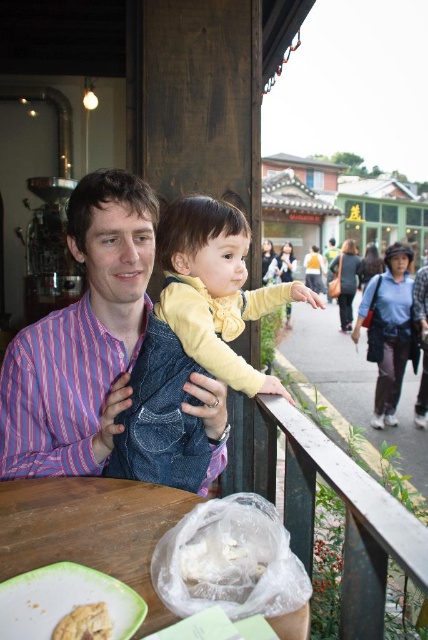
Between point (181, 484) and point (29, 492), which one is positioned behind?

The point (181, 484) is behind.

Can you confirm if denim vest at center is positioned below wooden table at lower left?

No, denim vest at center is not below wooden table at lower left.

I want to click on denim vest at center, so click(193, 340).

Looking at this image, between wooden table at lower left and golden crumbly pastry at lower left, which one is positioned higher?

Positioned higher is wooden table at lower left.

Can you confirm if wooden table at lower left is wider than golden crumbly pastry at lower left?

Yes, wooden table at lower left is wider than golden crumbly pastry at lower left.

Describe the element at coordinates (89, 529) in the screenshot. The width and height of the screenshot is (428, 640). I see `wooden table at lower left` at that location.

Where is `wooden table at lower left`? Image resolution: width=428 pixels, height=640 pixels. wooden table at lower left is located at coordinates tap(89, 529).

Does denim vest at center have a larger size compared to white plastic bag at lower center?

Yes, denim vest at center is bigger than white plastic bag at lower center.

Between denim vest at center and white plastic bag at lower center, which one has more height?

Standing taller between the two is denim vest at center.

Is point (175, 476) less distant than point (252, 566)?

No, (175, 476) is further to viewer.

This screenshot has height=640, width=428. What are the coordinates of `denim vest at center` in the screenshot? It's located at (193, 340).